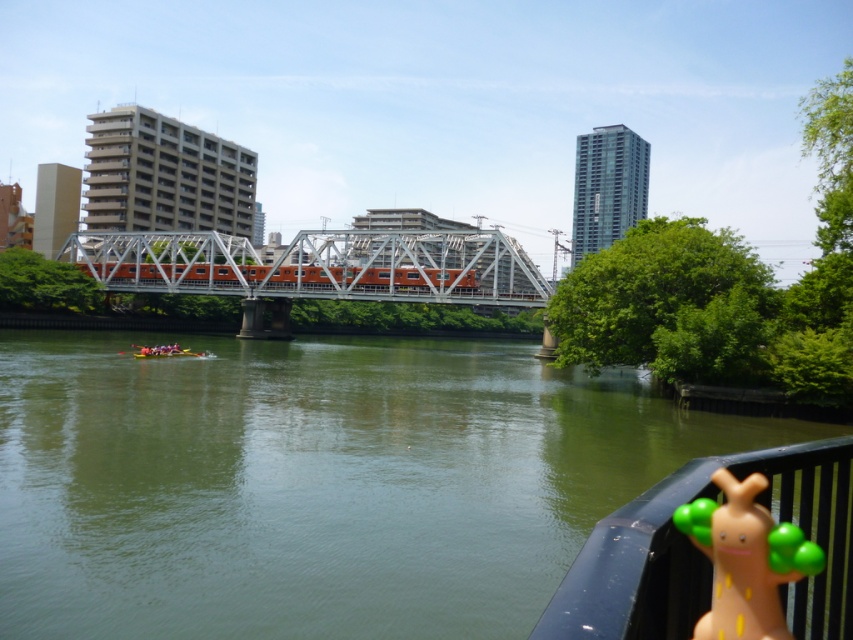
Question: Which point is closer to the camera?

Choices:
 (A) orange metallic bridge at center
 (B) yellow-green plastic boat at lower left

Answer: (B)

Question: Which point is closer to the camera?

Choices:
 (A) yellow-green plastic boat at lower left
 (B) orange metallic bridge at center

Answer: (A)

Question: Which object is the closest to the green smooth water at center?

Choices:
 (A) orange metallic bridge at center
 (B) yellow-green plastic boat at lower left

Answer: (B)

Question: Does green smooth water at center appear on the left side of yellow-green plastic boat at lower left?

Choices:
 (A) no
 (B) yes

Answer: (A)

Question: Is green rubber toy at lower right smaller than yellow-green plastic boat at lower left?

Choices:
 (A) no
 (B) yes

Answer: (B)

Question: Does green smooth water at center appear on the right side of yellow-green plastic boat at lower left?

Choices:
 (A) yes
 (B) no

Answer: (A)